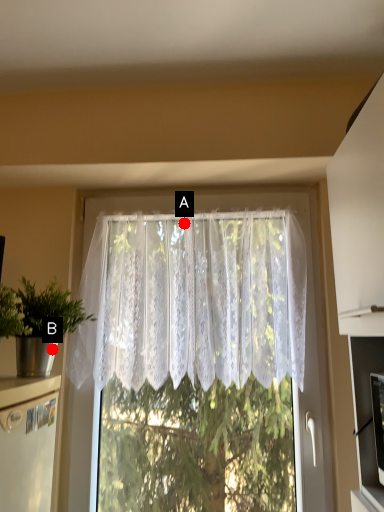
Question: Two points are circled on the image, labeled by A and B beside each circle. Which point is further to the camera?

Choices:
 (A) A is further
 (B) B is further

Answer: (A)